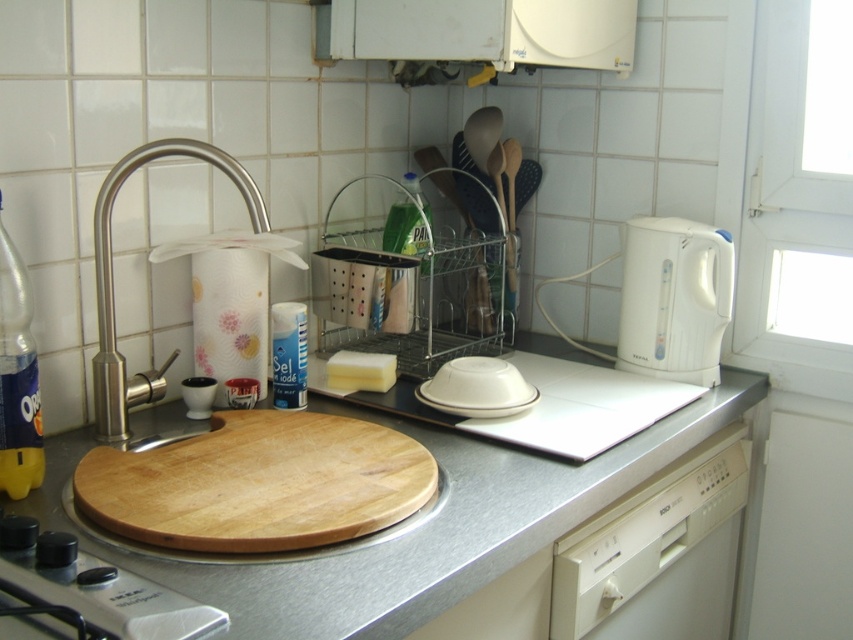
You need to place both the white plastic kettle at right and the brushed metal faucet at left on a shelf that can only hold items narrower than the faucet. Which item should you choose?

The white plastic kettle at right has a lesser width compared to the brushed metal faucet at left, so it should be chosen for the shelf.

You are organizing the kitchen counter and need to place a new spice jar between the wooden cutting board at center and the brushed metal faucet at left. Based on their positions, where should you position the spice jar relative to the faucet?

The wooden cutting board at center is located below the brushed metal faucet at left, so to place the spice jar between them, position it between the two objects, below the faucet and above the cutting board.

You are trying to determine which object is taller between the white plastic kettle at right and the brushed metal faucet at left. Based on the scene, which one is taller?

The brushed metal faucet at left is taller than the white plastic kettle at right.